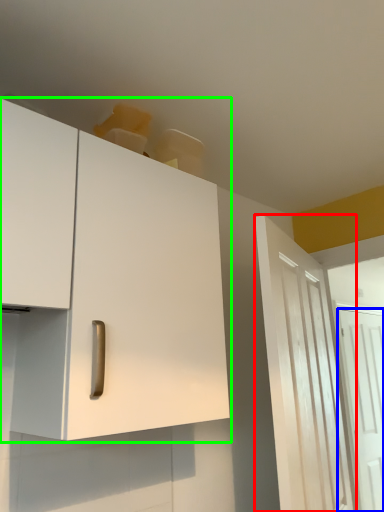
Question: Estimate the real-world distances between objects in this image. Which object is closer to door (highlighted by a red box), door (highlighted by a blue box) or cabinetry (highlighted by a green box)?

Choices:
 (A) door
 (B) cabinetry

Answer: (B)